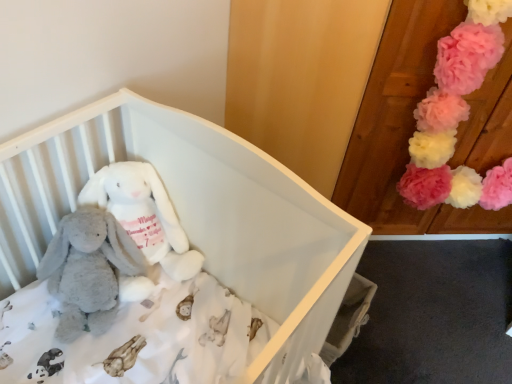
Question: Considering the relative positions of white plush infant bed at center and soft plush bunny at center, which is the 2th toy from right to left, in the image provided, is white plush infant bed at center to the left of soft plush bunny at center, which is the 2th toy from right to left, from the viewer's perspective?

Choices:
 (A) yes
 (B) no

Answer: (B)

Question: From the image's perspective, would you say white plush infant bed at center is shown under soft plush bunny at center, placed as the 2th toy when sorted from left to right?

Choices:
 (A) yes
 (B) no

Answer: (A)

Question: Considering the relative sizes of white plush infant bed at center and soft plush bunny at center, which is the 2th toy from right to left, in the image provided, is white plush infant bed at center shorter than soft plush bunny at center, which is the 2th toy from right to left,?

Choices:
 (A) no
 (B) yes

Answer: (A)

Question: From the image's perspective, is white plush infant bed at center on top of soft plush bunny at center, which is the 2th toy from right to left?

Choices:
 (A) no
 (B) yes

Answer: (A)

Question: From a real-world perspective, is white plush infant bed at center beneath soft plush bunny at center, which is the 2th toy from right to left?

Choices:
 (A) no
 (B) yes

Answer: (B)

Question: Is point (486, 26) closer or farther from the camera than point (11, 162)?

Choices:
 (A) farther
 (B) closer

Answer: (A)

Question: In terms of height, does fluffy pink pom-poms at upper right, placed as the first toy when sorted from right to left, look taller or shorter compared to white plush infant bed at center?

Choices:
 (A) short
 (B) tall

Answer: (A)

Question: Considering the positions of fluffy pink pom-poms at upper right, placed as the first toy when sorted from right to left, and white plush infant bed at center in the image, is fluffy pink pom-poms at upper right, placed as the first toy when sorted from right to left, bigger or smaller than white plush infant bed at center?

Choices:
 (A) big
 (B) small

Answer: (B)

Question: In terms of width, does fluffy pink pom-poms at upper right, placed as the first toy when sorted from right to left, look wider or thinner when compared to white plush infant bed at center?

Choices:
 (A) thin
 (B) wide

Answer: (A)

Question: Visually, is white plush infant bed at center positioned to the left or to the right of soft gray plush at center, which appears as the third toy when viewed from the right?

Choices:
 (A) right
 (B) left

Answer: (A)

Question: Considering the positions of point (5, 220) and point (58, 279), is point (5, 220) closer or farther from the camera than point (58, 279)?

Choices:
 (A) farther
 (B) closer

Answer: (B)

Question: Considering the positions of white plush infant bed at center and soft gray plush at center, which appears as the third toy when viewed from the right, in the image, is white plush infant bed at center taller or shorter than soft gray plush at center, which appears as the third toy when viewed from the right,?

Choices:
 (A) tall
 (B) short

Answer: (A)

Question: Considering their positions, is white plush infant bed at center located in front of or behind soft gray plush at center, which appears as the third toy when viewed from the right?

Choices:
 (A) behind
 (B) front

Answer: (B)

Question: In the image, is soft plush bunny at center, which is the 2th toy from right to left, positioned in front of or behind fluffy pink pom-poms at upper right, which is the third toy from left to right?

Choices:
 (A) front
 (B) behind

Answer: (A)

Question: Is soft plush bunny at center, which is the 2th toy from right to left, bigger or smaller than fluffy pink pom-poms at upper right, placed as the first toy when sorted from right to left?

Choices:
 (A) big
 (B) small

Answer: (B)